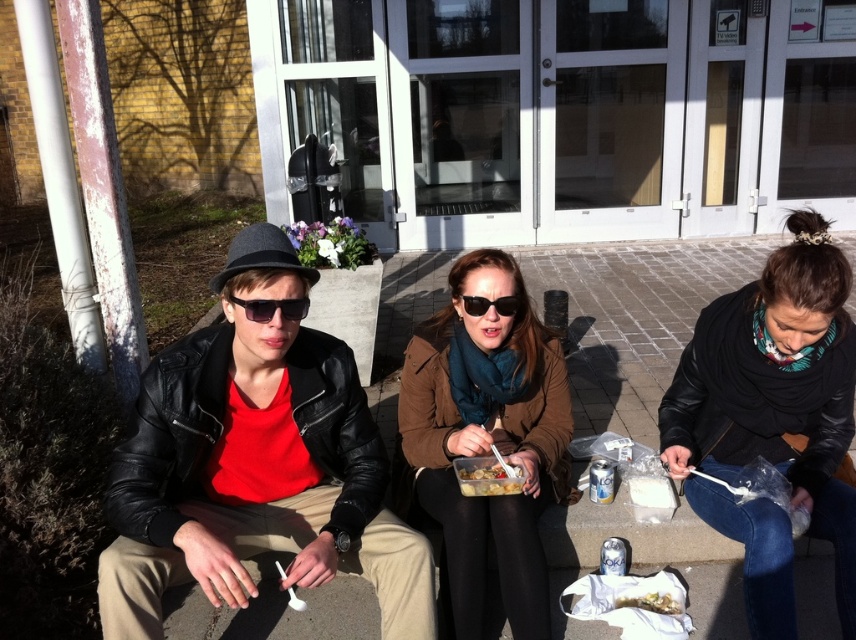
Question: Does black leather jacket at lower right lie in front of brown matte jacket at center?

Choices:
 (A) no
 (B) yes

Answer: (B)

Question: Which of these objects is positioned farthest from the black plastic sunglasses at center?

Choices:
 (A) shiny plastic container at center
 (B) black leather jacket at lower right
 (C) matte black leather jacket at left

Answer: (A)

Question: Can you confirm if black leather jacket at lower right is bigger than brown matte jacket at center?

Choices:
 (A) yes
 (B) no

Answer: (B)

Question: Can you confirm if matte black leather jacket at left is bigger than shiny plastic container at center?

Choices:
 (A) yes
 (B) no

Answer: (A)

Question: Which object is closer to the camera taking this photo?

Choices:
 (A) shiny plastic container at center
 (B) black plastic sunglasses at center

Answer: (B)

Question: Which object appears farthest from the camera in this image?

Choices:
 (A) brown matte jacket at center
 (B) shiny plastic container at center
 (C) sunglasses at center
 (D) matte black leather jacket at left

Answer: (B)